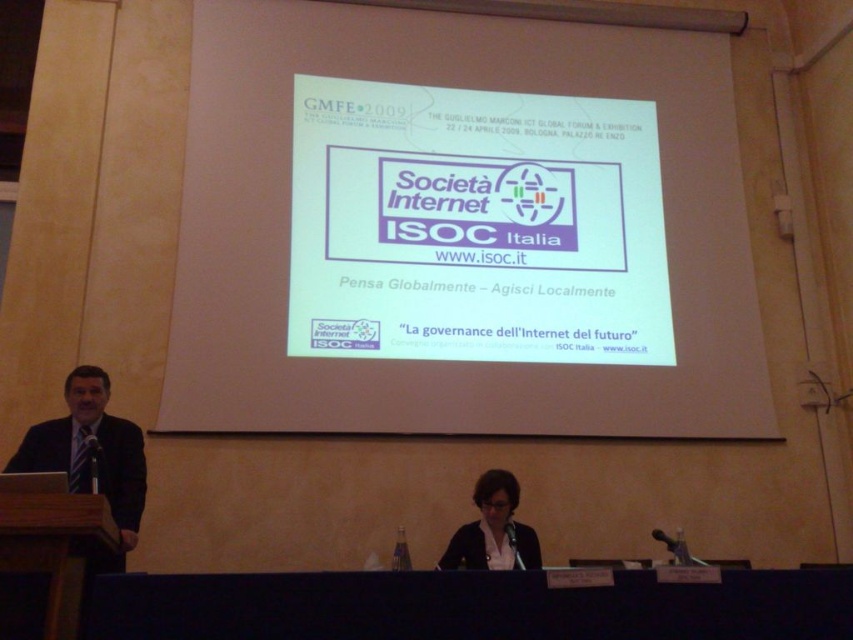
You are an attendee at the presentation and you see the point at coordinates (91,456). What object is located there?

The point at coordinates (91,456) indicates a dark suit at left.

You are organizing a conference and need to place a 20cm wide name tag on the table. The table has the wooden at lower left and the black matte business suit at center. Which object can the name tag be placed next to without overlapping?

The name tag can be placed next to the black matte business suit at center because the wooden at lower left is bigger and might not leave enough space.

Consider the image. You are an attendee at this presentation and want to take a photo of both the dark suit at left and the matte black jacket at center. Since you can only focus on one at a time, which one should you focus on first to ensure it appears in the foreground of your photo?

The dark suit at left is above matte black jacket at center, so focusing on the matte black jacket at center first will place it in the foreground since it is lower and closer to the camera.